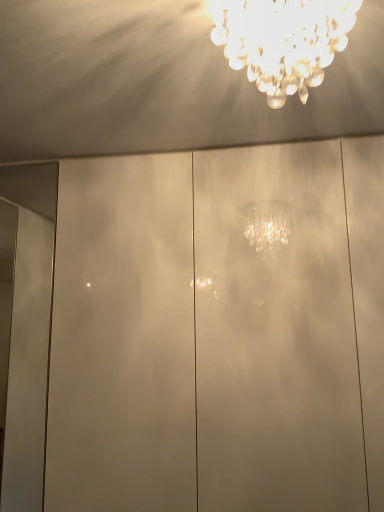
This screenshot has height=512, width=384. Describe the element at coordinates (25, 328) in the screenshot. I see `white glossy door at left` at that location.

Describe the element at coordinates (283, 41) in the screenshot. Image resolution: width=384 pixels, height=512 pixels. I see `clear crystal chandelier at upper center` at that location.

Locate an element on the screen. glossy white glass door at center is located at coordinates (217, 330).

Locate an element on the screen. white glossy door at left is located at coordinates (25, 328).

Is glossy white glass door at center next to white glossy door at left?

glossy white glass door at center is not next to white glossy door at left, and they're not touching.

In the scene shown: Can you confirm if glossy white glass door at center is wider than white glossy door at left?

Correct, the width of glossy white glass door at center exceeds that of white glossy door at left.

Is glossy white glass door at center located outside white glossy door at left?

Yes.

Which point is more forward, (105, 208) or (38, 408)?

The point (105, 208) is closer to the camera.

Does point (23, 475) appear closer or farther from the camera than point (226, 12)?

Point (23, 475) appears to be farther away from the viewer than point (226, 12).

Is white glossy door at left far away from clear crystal chandelier at upper center?

Yes, white glossy door at left is far from clear crystal chandelier at upper center.

In the scene shown: Which is correct: white glossy door at left is inside clear crystal chandelier at upper center, or outside of it?

white glossy door at left is located beyond the bounds of clear crystal chandelier at upper center.

Considering the relative sizes of white glossy door at left and clear crystal chandelier at upper center in the image provided, is white glossy door at left wider than clear crystal chandelier at upper center?

In fact, white glossy door at left might be narrower than clear crystal chandelier at upper center.

Is clear crystal chandelier at upper center facing away from glossy white glass door at center?

Yes.

Looking at this image, from the image's perspective, is clear crystal chandelier at upper center over glossy white glass door at center?

Yes, from the image's perspective, clear crystal chandelier at upper center is on top of glossy white glass door at center.

From a real-world perspective, between clear crystal chandelier at upper center and glossy white glass door at center, who is vertically lower?

glossy white glass door at center, from a real-world perspective.

Is point (273, 86) closer or farther from the camera than point (374, 337)?

Clearly, point (273, 86) is closer to the camera than point (374, 337).

Considering the sizes of objects clear crystal chandelier at upper center and white glossy door at left in the image provided, who is smaller, clear crystal chandelier at upper center or white glossy door at left?

white glossy door at left is smaller.

Visually, is clear crystal chandelier at upper center positioned to the left or to the right of white glossy door at left?

clear crystal chandelier at upper center is to the right of white glossy door at left.

Consider the image. Between clear crystal chandelier at upper center and white glossy door at left, which one has more height?

Standing taller between the two is white glossy door at left.

Find the location of a particular element. This screenshot has height=512, width=384. door that is below the clear crystal chandelier at upper center (from the image's perspective) is located at coordinates (25, 328).

Who is smaller, white glossy door at left or glossy white glass door at center?

white glossy door at left.

Which object is wider, white glossy door at left or glossy white glass door at center?

glossy white glass door at center is wider.

Can you see white glossy door at left touching glossy white glass door at center?

white glossy door at left is not next to glossy white glass door at center, and they're not touching.

Considering the sizes of objects white glossy door at left and glossy white glass door at center in the image provided, who is shorter, white glossy door at left or glossy white glass door at center?

white glossy door at left.

Which of these two, glossy white glass door at center or clear crystal chandelier at upper center, is thinner?

With smaller width is clear crystal chandelier at upper center.

Between glossy white glass door at center and clear crystal chandelier at upper center, which one has larger size?

glossy white glass door at center.

From a real-world perspective, is glossy white glass door at center positioned over clear crystal chandelier at upper center based on gravity?

No.

The height and width of the screenshot is (512, 384). I want to click on glass door on the right of clear crystal chandelier at upper center, so click(217, 330).

In order to click on door behind the glossy white glass door at center in this screenshot , I will do `click(25, 328)`.

At what (x,y) coordinates should I click in order to perform the action: click on door below the clear crystal chandelier at upper center (from a real-world perspective). Please return your answer as a coordinate pair (x, y). The height and width of the screenshot is (512, 384). Looking at the image, I should click on (25, 328).

Looking at this image, which object lies further to the anchor point white glossy door at left, clear crystal chandelier at upper center or glossy white glass door at center?

clear crystal chandelier at upper center is further to white glossy door at left.

When comparing their distances from glossy white glass door at center, does clear crystal chandelier at upper center or white glossy door at left seem closer?

Among the two, clear crystal chandelier at upper center is located nearer to glossy white glass door at center.

Looking at the image, which one is located closer to clear crystal chandelier at upper center, white glossy door at left or glossy white glass door at center?

The object closer to clear crystal chandelier at upper center is glossy white glass door at center.

Looking at the image, which one is located closer to white glossy door at left, glossy white glass door at center or clear crystal chandelier at upper center?

glossy white glass door at center is closer to white glossy door at left.

From the image, which object appears to be farther from clear crystal chandelier at upper center, glossy white glass door at center or white glossy door at left?

white glossy door at left.

From the image, which object appears to be farther from glossy white glass door at center, white glossy door at left or clear crystal chandelier at upper center?

Based on the image, white glossy door at left appears to be further to glossy white glass door at center.

Find the location of a particular element. lamp between white glossy door at left and glossy white glass door at center is located at coordinates pyautogui.click(x=283, y=41).